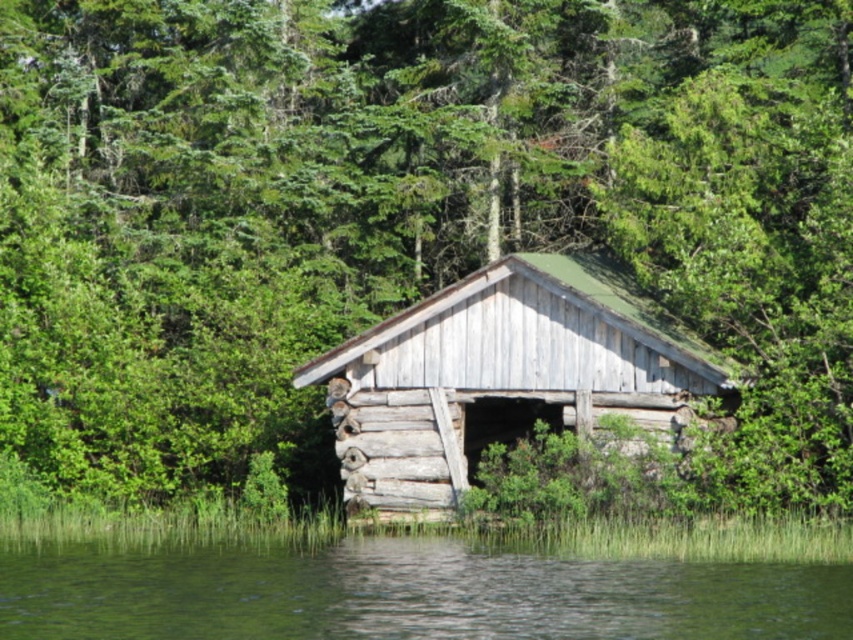
Question: Does green liquid water at lower center lie in front of weathered wood log cabin at center?

Choices:
 (A) no
 (B) yes

Answer: (B)

Question: Which of the following is the farthest from the observer?

Choices:
 (A) weathered wood log cabin at center
 (B) green liquid water at lower center

Answer: (A)

Question: Is green liquid water at lower center wider than weathered wood log cabin at center?

Choices:
 (A) yes
 (B) no

Answer: (A)

Question: Is green liquid water at lower center above weathered wood log cabin at center?

Choices:
 (A) yes
 (B) no

Answer: (B)